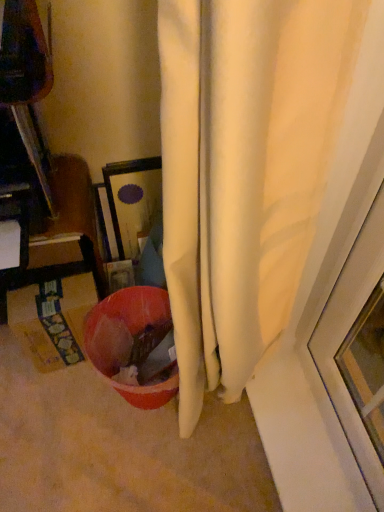
Describe the element at coordinates (134, 332) in the screenshot. I see `matte plastic bowl at lower center` at that location.

You are a GUI agent. You are given a task and a screenshot of the screen. Output one action in this format:
    pyautogui.click(x=<x>, y=<y>)
    Task: Click on the matte plastic bowl at lower center
    The width and height of the screenshot is (384, 512).
    Given the screenshot: What is the action you would take?
    pyautogui.click(x=134, y=332)

In order to face yellow cardboard box at lower left, should I rotate leftwards or rightwards?

It's best to rotate left around 16.929 degrees.

The image size is (384, 512). What do you see at coordinates (52, 319) in the screenshot? I see `yellow cardboard box at lower left` at bounding box center [52, 319].

Find the location of a particular element. This screenshot has height=512, width=384. yellow cardboard box at lower left is located at coordinates (52, 319).

Locate an element on the screen. This screenshot has height=512, width=384. matte plastic bowl at lower center is located at coordinates (134, 332).

Visually, is yellow cardboard box at lower left positioned to the left or to the right of matte plastic bowl at lower center?

In the image, yellow cardboard box at lower left appears on the left side of matte plastic bowl at lower center.

Is the position of yellow cardboard box at lower left more distant than that of matte plastic bowl at lower center?

Yes, yellow cardboard box at lower left is further from the camera.

Which is in front, point (77, 331) or point (95, 365)?

The point (77, 331) is closer.

From the image's perspective, is yellow cardboard box at lower left above or below matte plastic bowl at lower center?

yellow cardboard box at lower left is above matte plastic bowl at lower center.

From a real-world perspective, is yellow cardboard box at lower left above or below matte plastic bowl at lower center?

Clearly, from a real-world perspective, yellow cardboard box at lower left is above matte plastic bowl at lower center.

Which object is wider, yellow cardboard box at lower left or matte plastic bowl at lower center?

matte plastic bowl at lower center is wider.

Does yellow cardboard box at lower left have a lesser height compared to matte plastic bowl at lower center?

Correct, yellow cardboard box at lower left is not as tall as matte plastic bowl at lower center.

Between yellow cardboard box at lower left and matte plastic bowl at lower center, which one has smaller size?

yellow cardboard box at lower left is smaller.

Does yellow cardboard box at lower left contain matte plastic bowl at lower center?

That's incorrect, matte plastic bowl at lower center is not inside yellow cardboard box at lower left.

Is yellow cardboard box at lower left with matte plastic bowl at lower center?

yellow cardboard box at lower left and matte plastic bowl at lower center are not in contact.

Could you tell me if yellow cardboard box at lower left is turned towards matte plastic bowl at lower center?

No, yellow cardboard box at lower left does not turn towards matte plastic bowl at lower center.

How far apart are yellow cardboard box at lower left and matte plastic bowl at lower center?

They are 14.35 centimeters apart.

Image resolution: width=384 pixels, height=512 pixels. In the image, there is a yellow cardboard box at lower left. What are the coordinates of `bowl below it (from the image's perspective)` in the screenshot? It's located at (134, 332).

Considering the relative positions of matte plastic bowl at lower center and yellow cardboard box at lower left in the image provided, is matte plastic bowl at lower center to the left of yellow cardboard box at lower left from the viewer's perspective?

No, matte plastic bowl at lower center is not to the left of yellow cardboard box at lower left.

Is matte plastic bowl at lower center closer to the viewer compared to yellow cardboard box at lower left?

That is True.

Which is in front, point (150, 303) or point (82, 296)?

The point (82, 296) is in front.

From the image's perspective, which one is positioned higher, matte plastic bowl at lower center or yellow cardboard box at lower left?

yellow cardboard box at lower left.

From a real-world perspective, does matte plastic bowl at lower center sit lower than yellow cardboard box at lower left?

Yes, from a real-world perspective, matte plastic bowl at lower center is beneath yellow cardboard box at lower left.

Which object is wider, matte plastic bowl at lower center or yellow cardboard box at lower left?

matte plastic bowl at lower center is wider.

Between matte plastic bowl at lower center and yellow cardboard box at lower left, which one has less height?

With less height is yellow cardboard box at lower left.

In the scene shown: Is matte plastic bowl at lower center bigger than yellow cardboard box at lower left?

Correct, matte plastic bowl at lower center is larger in size than yellow cardboard box at lower left.

Is matte plastic bowl at lower center situated inside yellow cardboard box at lower left or outside?

The correct answer is: outside.

Is the surface of matte plastic bowl at lower center in direct contact with yellow cardboard box at lower left?

They are not placed beside each other.

Is matte plastic bowl at lower center positioned with its back to yellow cardboard box at lower left?

No, matte plastic bowl at lower center's orientation is not away from yellow cardboard box at lower left.

In the scene shown: How much distance is there between matte plastic bowl at lower center and yellow cardboard box at lower left?

matte plastic bowl at lower center is 5.65 inches away from yellow cardboard box at lower left.

At what (x,y) coordinates should I click in order to perform the action: click on cardboard box to the left of matte plastic bowl at lower center. Please return your answer as a coordinate pair (x, y). This screenshot has width=384, height=512. Looking at the image, I should click on (52, 319).

You are a GUI agent. You are given a task and a screenshot of the screen. Output one action in this format:
    pyautogui.click(x=<x>, y=<y>)
    Task: Click on the bowl below the yellow cardboard box at lower left (from the image's perspective)
    The width and height of the screenshot is (384, 512).
    Given the screenshot: What is the action you would take?
    pyautogui.click(x=134, y=332)

Locate an element on the screen. bowl below the yellow cardboard box at lower left (from a real-world perspective) is located at coordinates (134, 332).